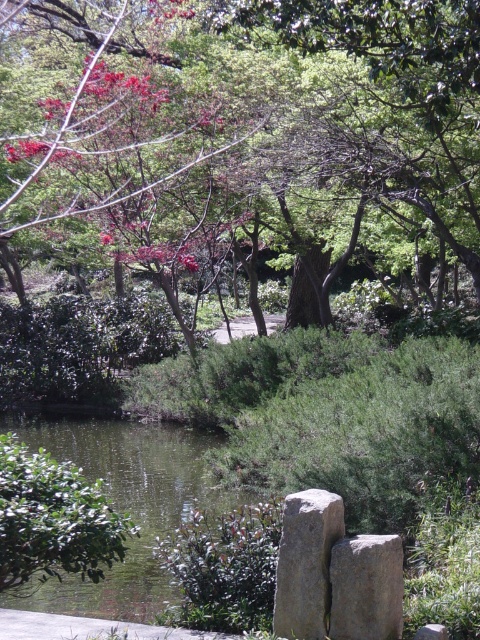
You are sitting on a bench in the garden and want to place a small potted plant between the gray rough stone at center and the smooth gray stone at center. Which stone should you place the plant closer to if you want it to be nearer to the viewer?

You should place the small potted plant closer to the gray rough stone at center because it is closer to the viewer than the smooth gray stone at center.

You are sitting on the gray rough stone at center and want to reach the gray stone at center. Which direction should you move to get there?

The gray rough stone at center is positioned on the left side of gray stone at center, so you should move to the right to reach the gray stone at center.

You are planning to place a small decorative statue that requires a base larger than the gray rough stone at center. Based on the scene, is there a suitable location near the green liquid water at center where the statue can be placed?

The green liquid water at center is larger in size than the gray rough stone at center, so placing the statue on the green liquid water at center may not be feasible since it is a body of water. However, the gray rough stone at center could serve as a potential base if its size meets the requirement. Since the statue needs a base larger than the gray rough stone at center, neither option is suitable based on the provided information.